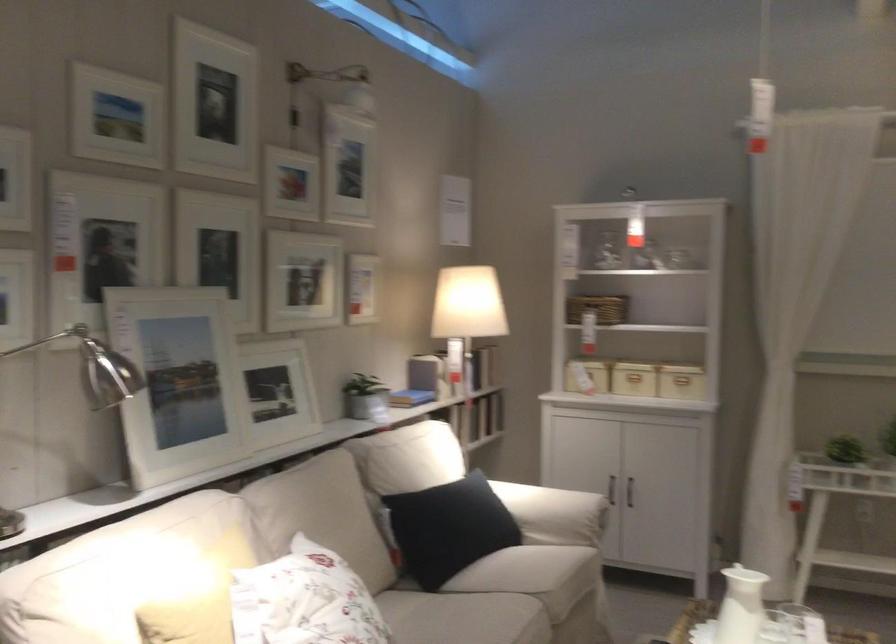
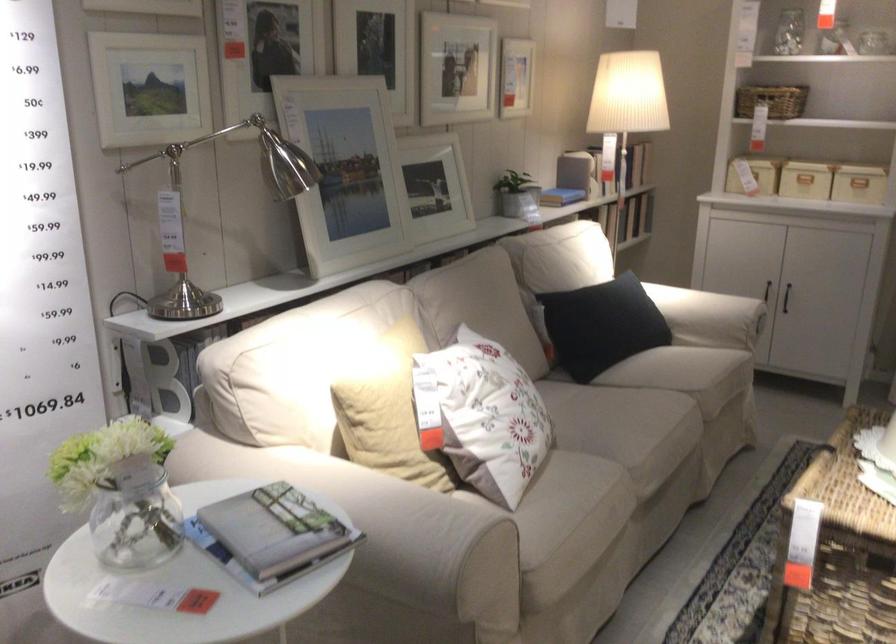
Where in the second image is the point corresponding to (554,524) from the first image?

(709, 317)